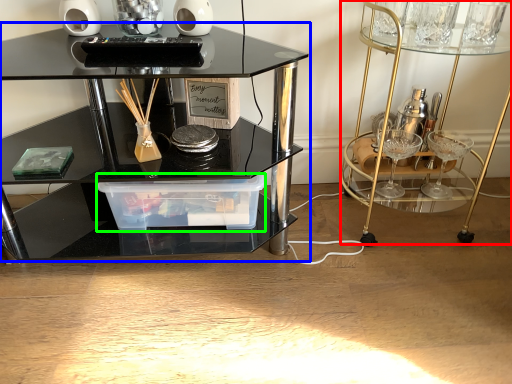
Question: Which object is positioned farthest from vanity (highlighted by a red box)? Select from table (highlighted by a blue box) and glass box (highlighted by a green box).

Choices:
 (A) table
 (B) glass box

Answer: (A)